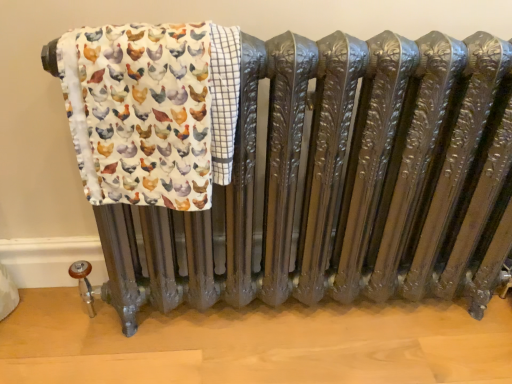
Find the location of a particular element. The width and height of the screenshot is (512, 384). vacant area situated below white fabric with chicken print at center (from a real-world perspective) is located at coordinates (184, 324).